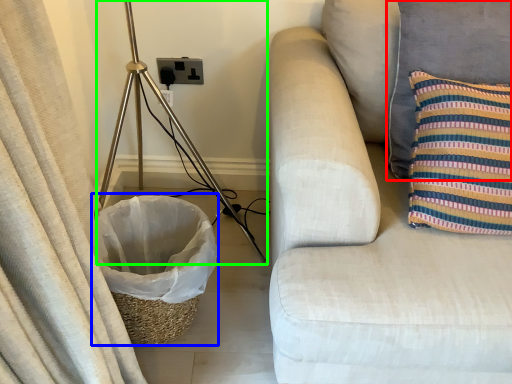
Question: Which object is the closest to the pillow (highlighted by a red box)? Choose among these: laundry basket (highlighted by a blue box) or tripod (highlighted by a green box).

Choices:
 (A) laundry basket
 (B) tripod

Answer: (A)